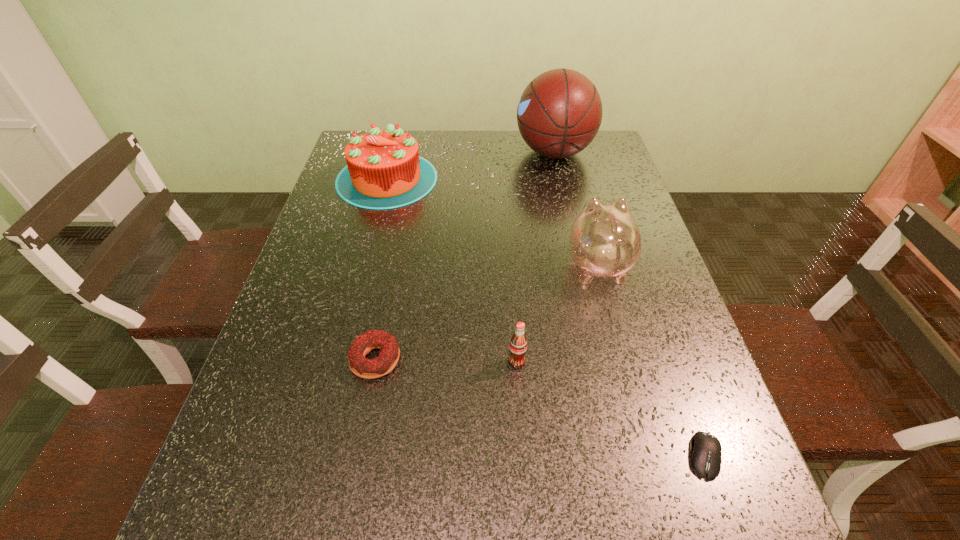
The image size is (960, 540). In order to click on free space located 0.270m on the front facing side of the piggy bank in this screenshot , I will do coord(575,179).

What are the coordinates of `vacant space located 0.150m on the front facing side of the piggy bank` in the screenshot? It's located at (582, 204).

Image resolution: width=960 pixels, height=540 pixels. Identify the location of free point located on the front facing side of the piggy bank. (x=574, y=173).

The image size is (960, 540). I want to click on free space located on the left of the third shortest object, so click(x=406, y=362).

At what (x,y) coordinates should I click in order to perform the action: click on free space located 0.290m on the right of the fifth tallest object. Please return your answer as a coordinate pair (x, y). Looking at the image, I should click on (547, 359).

This screenshot has width=960, height=540. I want to click on vacant space located 0.200m on the back of the nearest object, so click(663, 338).

Where is `basketball situated at the far edge`? basketball situated at the far edge is located at coordinates (559, 113).

This screenshot has width=960, height=540. I want to click on cake located in the far edge section of the desktop, so [384, 170].

At what (x,y) coordinates should I click in order to perform the action: click on object that is at the left edge. Please return your answer as a coordinate pair (x, y). This screenshot has width=960, height=540. Looking at the image, I should click on (384, 170).

You are a GUI agent. You are given a task and a screenshot of the screen. Output one action in this format:
    pyautogui.click(x=<x>, y=<y>)
    Task: Click on the basketball located at the right edge
    
    Given the screenshot: What is the action you would take?
    pyautogui.click(x=559, y=113)